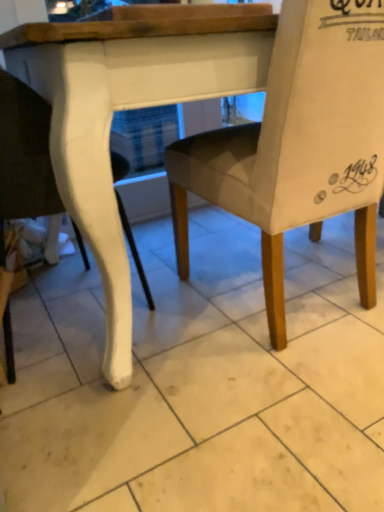
The height and width of the screenshot is (512, 384). Find the location of `vacant area in front of light gray fabric chair at center, which appears as the first chair when viewed from the right`. vacant area in front of light gray fabric chair at center, which appears as the first chair when viewed from the right is located at coordinates (256, 415).